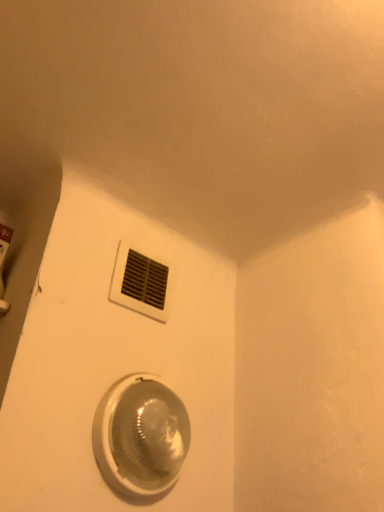
Image resolution: width=384 pixels, height=512 pixels. I want to click on white plastic vent at upper center, so click(140, 282).

What is the approximate height of white plastic vent at upper center?

white plastic vent at upper center is 6.91 inches tall.

This screenshot has width=384, height=512. What do you see at coordinates (140, 282) in the screenshot?
I see `white plastic vent at upper center` at bounding box center [140, 282].

Measure the distance between point (157, 384) and camera.

The distance of point (157, 384) from camera is 36.38 inches.

What do you see at coordinates (140, 436) in the screenshot?
I see `translucent plastic light fixture at lower center` at bounding box center [140, 436].

What are the coordinates of `translucent plastic light fixture at lower center` in the screenshot? It's located at (140, 436).

Consider the image. Measure the distance between translucent plastic light fixture at lower center and camera.

A distance of 31.91 inches exists between translucent plastic light fixture at lower center and camera.

This screenshot has width=384, height=512. Find the location of `white plastic vent at upper center`. white plastic vent at upper center is located at coordinates (140, 282).

In the image, is white plastic vent at upper center on the left side or the right side of translucent plastic light fixture at lower center?

white plastic vent at upper center is to the left of translucent plastic light fixture at lower center.

Which object is closer to the camera taking this photo, white plastic vent at upper center or translucent plastic light fixture at lower center?

translucent plastic light fixture at lower center is closer to the camera.

Which is less distant, (119, 303) or (172, 391)?

Point (119, 303)

From the image's perspective, is white plastic vent at upper center below translucent plastic light fixture at lower center?

Incorrect, from the image's perspective, white plastic vent at upper center is higher than translucent plastic light fixture at lower center.

From a real-world perspective, relative to translucent plastic light fixture at lower center, is white plastic vent at upper center vertically above or below?

Clearly, from a real-world perspective, white plastic vent at upper center is above translucent plastic light fixture at lower center.

Consider the image. In terms of width, does white plastic vent at upper center look wider or thinner when compared to translucent plastic light fixture at lower center?

Considering their sizes, white plastic vent at upper center looks slimmer than translucent plastic light fixture at lower center.

Considering the sizes of objects white plastic vent at upper center and translucent plastic light fixture at lower center in the image provided, who is taller, white plastic vent at upper center or translucent plastic light fixture at lower center?

translucent plastic light fixture at lower center.

Between white plastic vent at upper center and translucent plastic light fixture at lower center, which one has larger size?

translucent plastic light fixture at lower center is bigger.

Is translucent plastic light fixture at lower center completely or partially inside white plastic vent at upper center?

That's incorrect, translucent plastic light fixture at lower center is not inside white plastic vent at upper center.

Is white plastic vent at upper center not near translucent plastic light fixture at lower center?

No, white plastic vent at upper center is in close proximity to translucent plastic light fixture at lower center.

Is white plastic vent at upper center facing towards translucent plastic light fixture at lower center?

No, white plastic vent at upper center is not facing towards translucent plastic light fixture at lower center.

How different are the orientations of white plastic vent at upper center and translucent plastic light fixture at lower center in degrees?

They differ by 1.62 degrees in their facing directions.

Measure the distance between white plastic vent at upper center and translucent plastic light fixture at lower center.

The distance of white plastic vent at upper center from translucent plastic light fixture at lower center is 10.65 inches.

This screenshot has width=384, height=512. What are the coordinates of `home appliance lying on the right of white plastic vent at upper center` in the screenshot? It's located at (140, 436).

Which is more to the left, translucent plastic light fixture at lower center or white plastic vent at upper center?

white plastic vent at upper center is more to the left.

Which is in front, translucent plastic light fixture at lower center or white plastic vent at upper center?

translucent plastic light fixture at lower center is in front.

Is point (118, 392) positioned in front of point (161, 284)?

Yes, it is.

From the image's perspective, would you say translucent plastic light fixture at lower center is shown under white plastic vent at upper center?

Yes.

From a real-world perspective, who is located higher, translucent plastic light fixture at lower center or white plastic vent at upper center?

white plastic vent at upper center is physically above.

Is translucent plastic light fixture at lower center thinner than white plastic vent at upper center?

Incorrect, the width of translucent plastic light fixture at lower center is not less than that of white plastic vent at upper center.

Can you confirm if translucent plastic light fixture at lower center is taller than white plastic vent at upper center?

Yes, translucent plastic light fixture at lower center is taller than white plastic vent at upper center.

Considering the relative sizes of translucent plastic light fixture at lower center and white plastic vent at upper center in the image provided, is translucent plastic light fixture at lower center smaller than white plastic vent at upper center?

No.

Would you say translucent plastic light fixture at lower center is outside white plastic vent at upper center?

That's correct, translucent plastic light fixture at lower center is outside of white plastic vent at upper center.

Would you consider translucent plastic light fixture at lower center to be distant from white plastic vent at upper center?

No.

Is translucent plastic light fixture at lower center turned away from white plastic vent at upper center?

That's not correct — translucent plastic light fixture at lower center is not looking away from white plastic vent at upper center.

Find the location of a particular element. This screenshot has height=512, width=384. home appliance that appears below the white plastic vent at upper center (from the image's perspective) is located at coordinates (140, 436).

Find the location of a particular element. This screenshot has width=384, height=512. home appliance located underneath the white plastic vent at upper center (from a real-world perspective) is located at coordinates (140, 436).

Image resolution: width=384 pixels, height=512 pixels. Find the location of `home appliance on the right of white plastic vent at upper center`. home appliance on the right of white plastic vent at upper center is located at coordinates (140, 436).